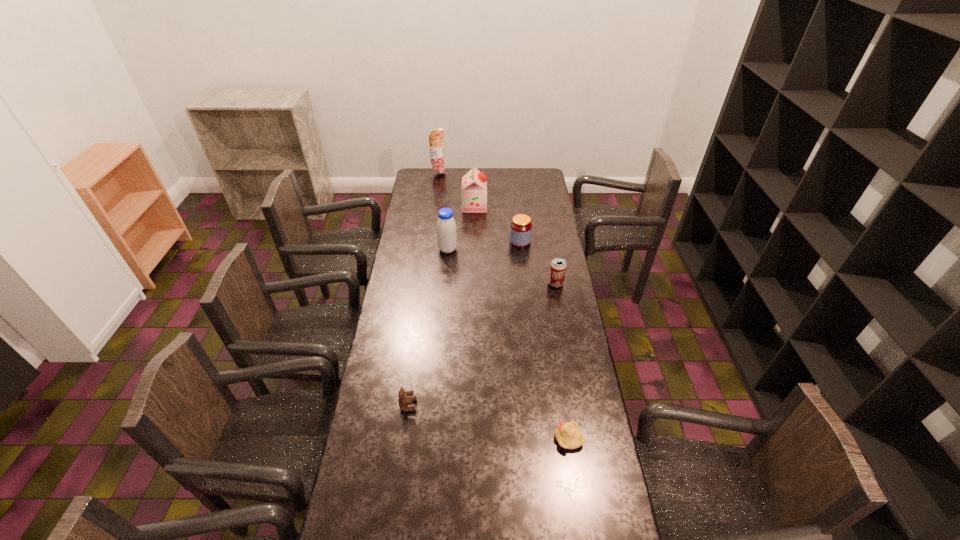
This screenshot has height=540, width=960. Find the location of `free space at the far left corner of the desktop`. free space at the far left corner of the desktop is located at coordinates (432, 188).

Locate an element on the screen. The height and width of the screenshot is (540, 960). free space between the right soya milk and the teddy bear is located at coordinates (442, 305).

Locate an element on the screen. free space that is in between the nearer soya milk and the right soya milk is located at coordinates (461, 227).

This screenshot has width=960, height=540. Find the location of `free spot between the left soya milk and the teddy bear`. free spot between the left soya milk and the teddy bear is located at coordinates (428, 327).

You are a GUI agent. You are given a task and a screenshot of the screen. Output one action in this format:
    pyautogui.click(x=<x>, y=<y>)
    Task: Click on the free spot between the shortest object and the fourth object from left to right
    
    Given the screenshot: What is the action you would take?
    pyautogui.click(x=521, y=322)

The height and width of the screenshot is (540, 960). What are the coordinates of `free space between the jar and the teddy bear` in the screenshot? It's located at (464, 323).

The image size is (960, 540). In order to click on vacant region between the jar and the fifth object from right to left in this screenshot , I will do `click(484, 245)`.

Find the location of a particular element. The image size is (960, 540). free point between the jar and the farther soya milk is located at coordinates (497, 224).

Image resolution: width=960 pixels, height=540 pixels. Identify the location of vacant area between the third nearest object and the teddy bear. (482, 345).

Identify the location of free area in between the duckling and the fifth farthest object. (563, 361).